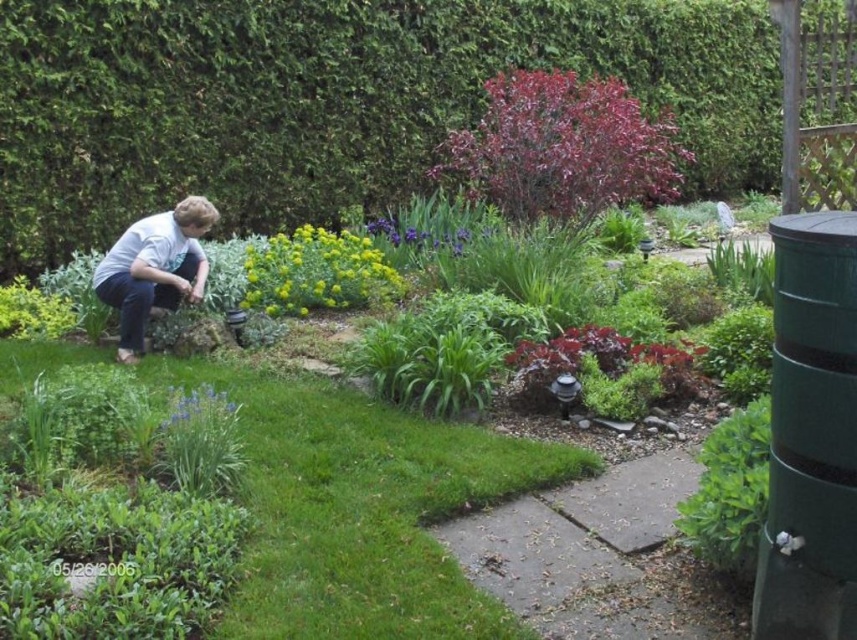
Question: Can you confirm if green matte barrel at right is positioned above white cotton shirt at lower left?

Choices:
 (A) no
 (B) yes

Answer: (A)

Question: Which point appears closest to the camera in this image?

Choices:
 (A) (470, 236)
 (B) (556, 184)
 (C) (745, 176)
 (D) (517, 356)

Answer: (D)

Question: Which point is closer to the camera taking this photo?

Choices:
 (A) (264, 257)
 (B) (208, 396)
 (C) (282, 216)

Answer: (B)

Question: Is green leafy bush at center positioned before blue matte flower at lower center?

Choices:
 (A) no
 (B) yes

Answer: (A)

Question: Which object appears closest to the camera in this image?

Choices:
 (A) green matte barrel at right
 (B) green grass at lower center

Answer: (A)

Question: Observing the image, what is the correct spatial positioning of green grass at lower center in reference to purple matte flower at center?

Choices:
 (A) below
 (B) above

Answer: (A)